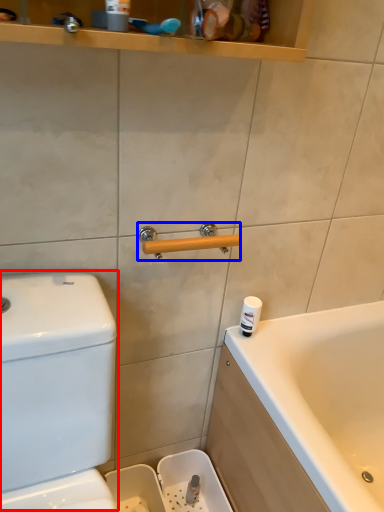
Question: Which object appears closest to the camera in this image, water tank (highlighted by a red box) or door handle (highlighted by a blue box)?

Choices:
 (A) water tank
 (B) door handle

Answer: (A)